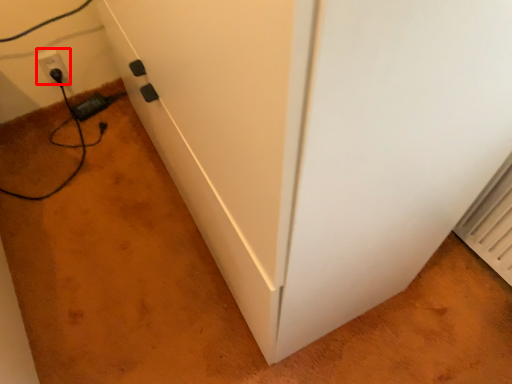
Question: From the image's perspective, where is electric outlet (annotated by the red box) located relative to plug?

Choices:
 (A) above
 (B) below

Answer: (A)